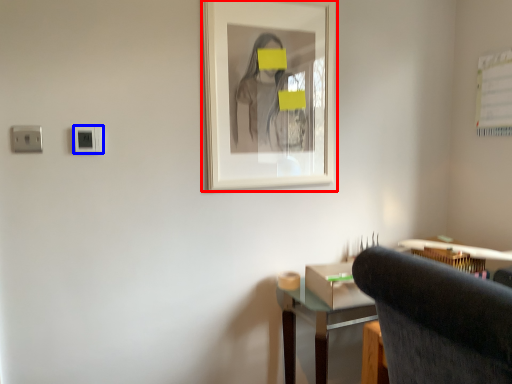
Question: Which of the following is the farthest to the observer, picture frame (highlighted by a red box) or electric outlet (highlighted by a blue box)?

Choices:
 (A) picture frame
 (B) electric outlet

Answer: (A)